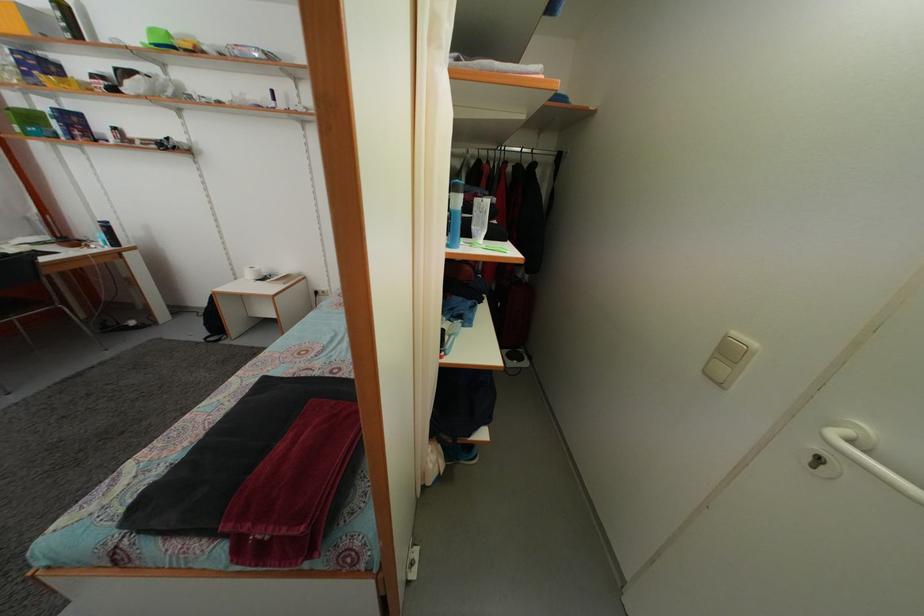
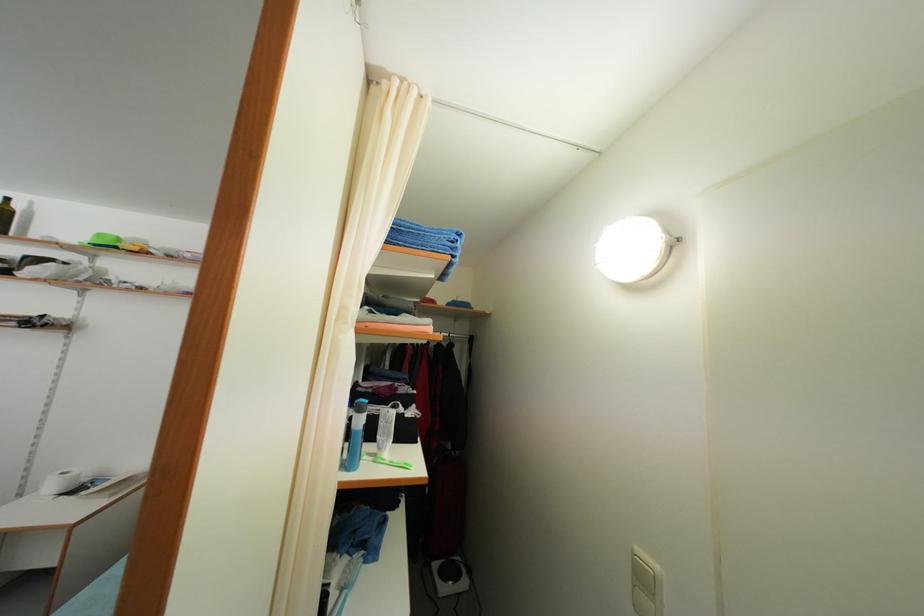
Where in the second image is the point corresponding to point 735,360 from the first image?

(649, 586)